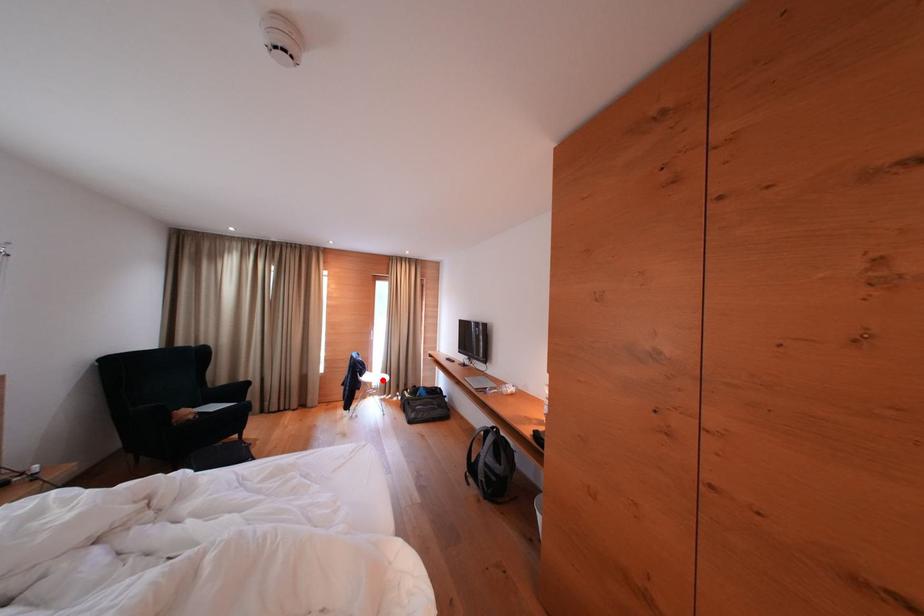
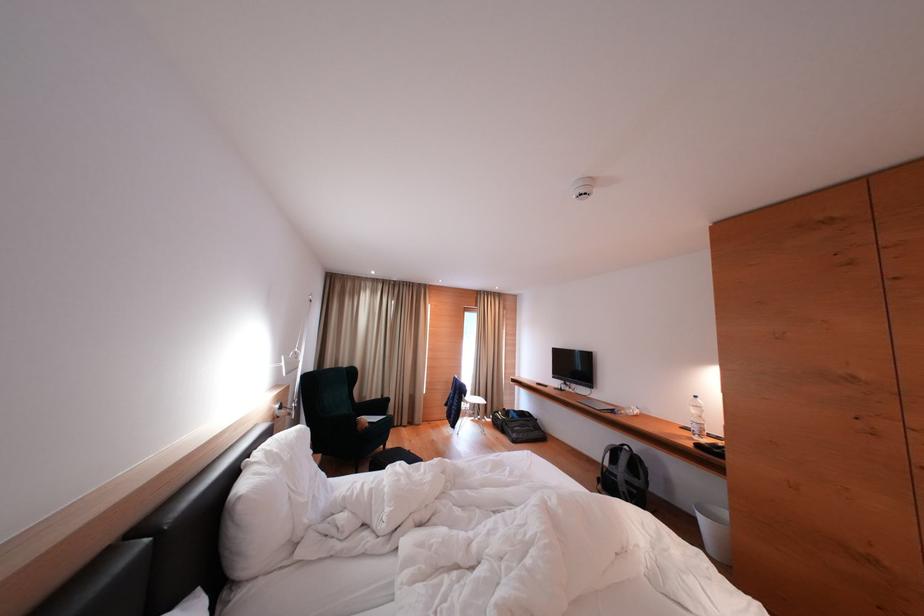
Where in the second image is the point corresponding to the highlighted location from the first image?

(477, 402)